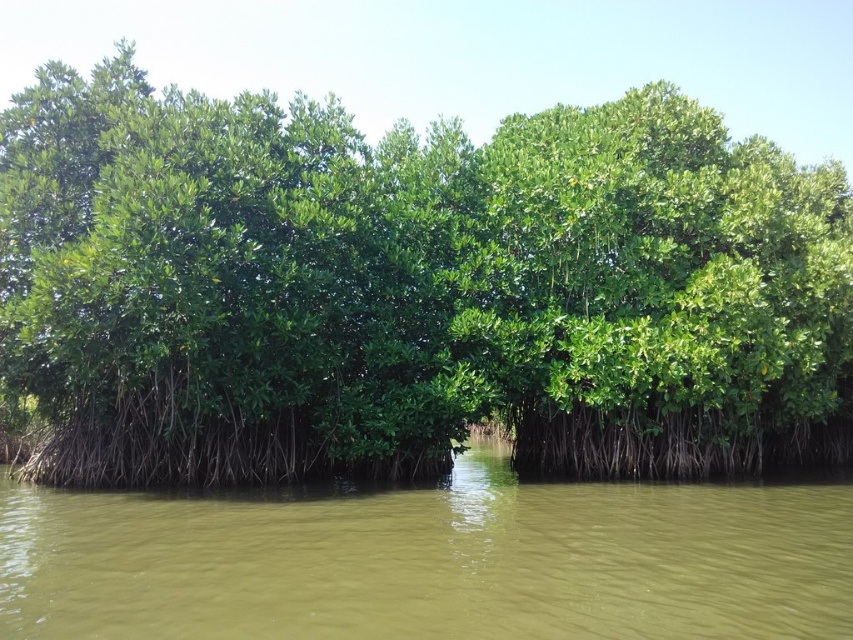
You are a kayaker navigating through the mangrove area. You see the green leafy mangrove at center and the green muddy water at center. Which object is located to the right of the other?

The green leafy mangrove at center is positioned on the left side of green muddy water at center, so the green muddy water at center is to the right of the green leafy mangrove at center.

You are a bird flying over the mangrove area and want to land on the highest point in the scene. Which object between the green leafy mangrove at center and the green muddy water at center should you choose?

The green leafy mangrove at center has a greater height compared to green muddy water at center, so you should choose the green leafy mangrove at center to land on the highest point.